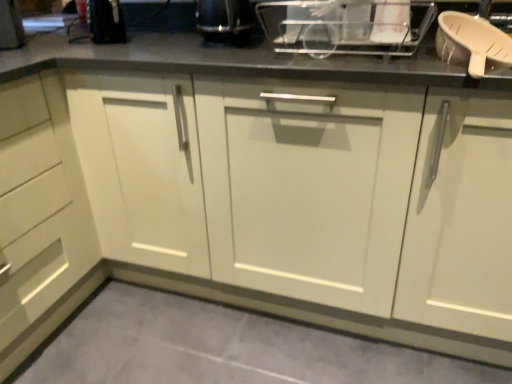
Locate an element on the screen. free point below black plastic kettle at upper center, acting as the 1th appliance starting from the left (from a real-world perspective) is located at coordinates (216, 46).